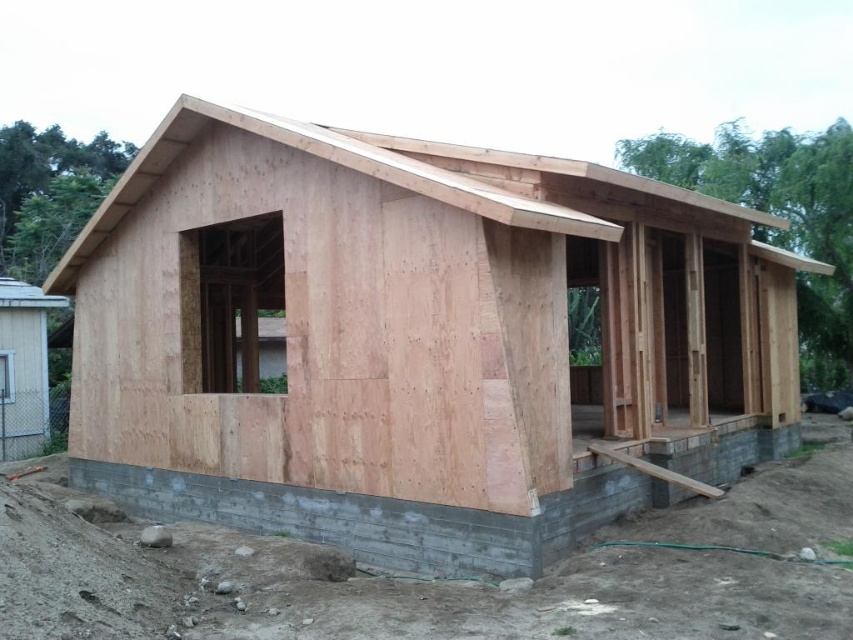
You are an architect inspecting the construction site of the partially built wooden house. You need to determine the spatial relationship between the gray concrete foundation at lower center and the natural wood roof at upper center. Which object is closer to your viewpoint?

The gray concrete foundation at lower center is closer to the viewer than the natural wood roof at upper center.

You are an architect inspecting the construction site. You need to determine if the natural wood house at center will fit within the gray concrete foundation at lower center. Based on the provided scene and objects, what is your conclusion?

The natural wood house at center has a width that surpasses the gray concrete foundation at lower center. Therefore, the house is wider than the foundation, which means it will not fit within the current foundation dimensions.

You are an architect inspecting the construction site of a new wooden house. You notice the natural wood house at center and the natural wood roof at upper center. Based on their positions, which one is situated higher in the structure?

The natural wood roof at upper center is higher in the structure because the natural wood house at center is situated below it.